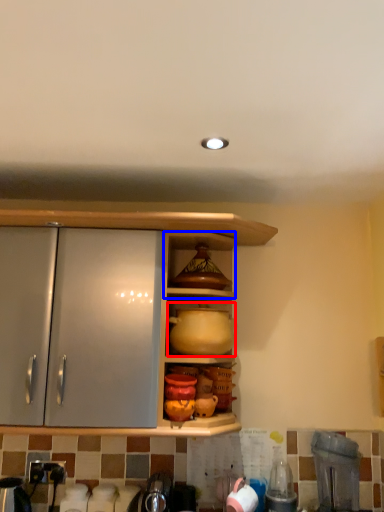
Question: Which object appears farthest to the camera in this image, pottery (highlighted by a red box) or shelf (highlighted by a blue box)?

Choices:
 (A) pottery
 (B) shelf

Answer: (B)